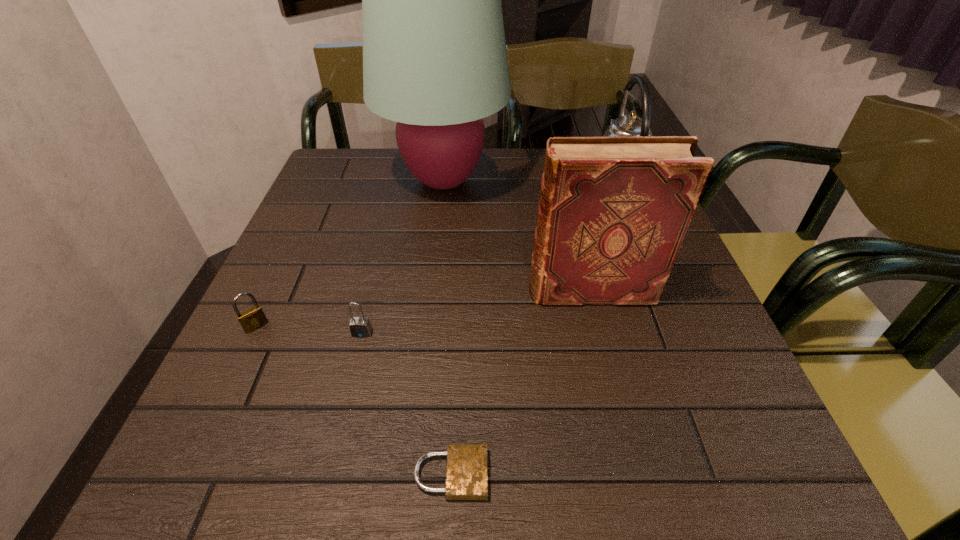
Where is `vacant space situated on the spine side of the third farthest object`? The image size is (960, 540). vacant space situated on the spine side of the third farthest object is located at coordinates (363, 291).

The width and height of the screenshot is (960, 540). I want to click on vacant space located from the spout of the kettle, so click(x=506, y=195).

Where is `blank space located from the spout of the kettle`? The height and width of the screenshot is (540, 960). blank space located from the spout of the kettle is located at coordinates (470, 195).

The height and width of the screenshot is (540, 960). I want to click on vacant area situated 0.340m from the spout of the kettle, so click(x=444, y=195).

I want to click on vacant area located on the front of the leftmost padlock, so click(x=198, y=453).

Where is `vacant space positioned on the shackle of the second padlock from left to right`? The height and width of the screenshot is (540, 960). vacant space positioned on the shackle of the second padlock from left to right is located at coordinates pyautogui.click(x=344, y=409).

Identify the location of free region located on the keyhole side of the nearest padlock. (686, 474).

Where is `lampshade at the far edge`? Image resolution: width=960 pixels, height=540 pixels. lampshade at the far edge is located at coordinates (435, 61).

Where is `kettle that is positioned at the far edge`? Image resolution: width=960 pixels, height=540 pixels. kettle that is positioned at the far edge is located at coordinates (626, 125).

You are a GUI agent. You are given a task and a screenshot of the screen. Output one action in this format:
    pyautogui.click(x=<x>, y=<y>)
    Task: Click on the object at the near edge
    
    Given the screenshot: What is the action you would take?
    pyautogui.click(x=466, y=476)